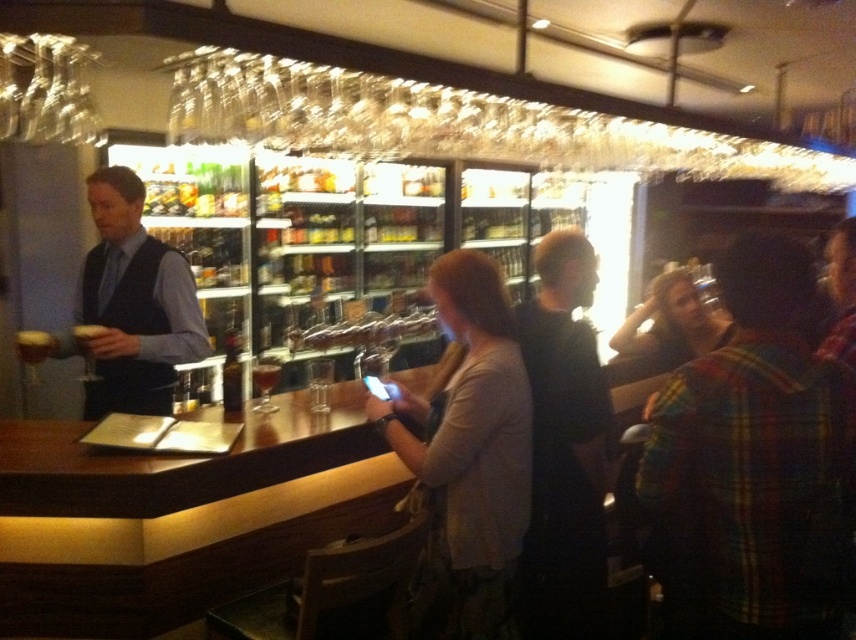
You are a bartender trying to place a new wine glass on the bar. You have two options for placement spots. One is next to the translucent glass wine glass at bar left and the other is in front of the translucent glass at bar front. Which spot would allow the new glass to fit better without overlapping?

The translucent glass wine glass at bar left might be wider than the translucent glass at bar front, so placing the new glass next to the translucent glass wine glass at bar left would require more space. Therefore, the spot in front of the translucent glass at bar front is better for fitting the new glass without overlapping.

You are a customer at the bar and want to order a drink. The bartender is holding a glass. Which glass is closer to you, the transparent glass at bar or the translucent glass at bar front?

The translucent glass at bar front is closer to you since it is positioned at the front compared to the transparent glass at bar, which is further back.

You are a customer at the bar and want to order a drink. The bar has a well stocked bar with shelves of alcohol and hanging wine glasses. There is a point labeled at coordinates (33, 349) which marks a translucent glass wine glass at bar left. Where exactly is the translucent glass wine glass at bar left located in relation to the bar counter?

The translucent glass wine glass at bar left is located at the coordinates point (33, 349), which is on the left side of the bar counter.